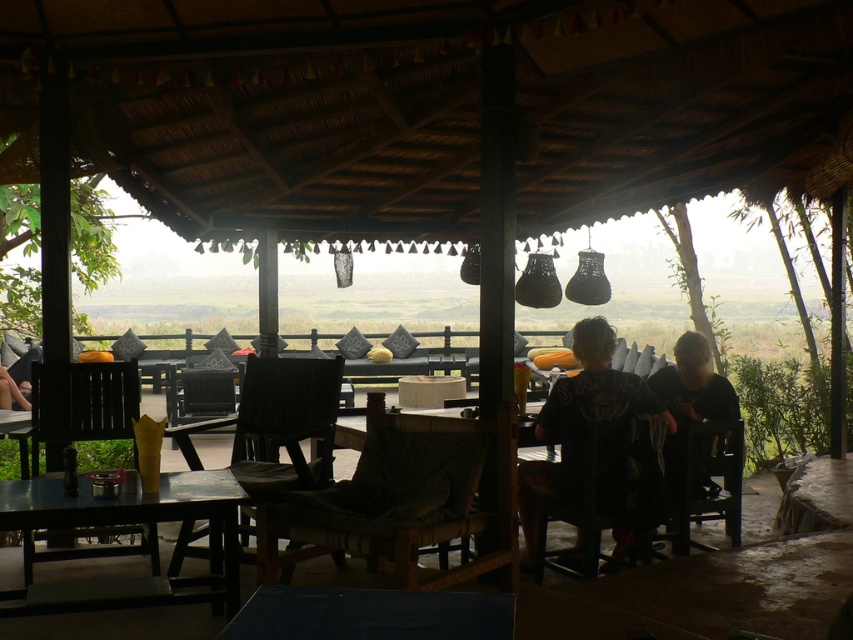
Measure the distance between point (218,476) and camera.

Point (218,476) is 3.64 meters away from camera.

Which is more to the left, wooden table at lower left or dark brown leather jacket at center?

wooden table at lower left is more to the left.

Identify the location of wooden table at lower left. The height and width of the screenshot is (640, 853). (125, 522).

Between point (730, 442) and point (1, 406), which one is positioned in front?

Point (730, 442) is in front.

Could you measure the distance between dark brown wooden chair at lower right and dark brown leather chair at lower left?

They are 7.01 meters apart.

Between point (688, 476) and point (0, 368), which one is positioned behind?

The point (0, 368) is behind.

Locate an element on the screen. dark brown wooden chair at lower right is located at coordinates (704, 480).

This screenshot has height=640, width=853. Identify the location of wooden table at lower left. (125, 522).

Which is behind, point (199, 497) or point (724, 416)?

The point (724, 416) is more distant.

Does point (164, 593) come farther from viewer compared to point (695, 404)?

No, (164, 593) is closer to viewer.

Where is `wooden table at lower left`? wooden table at lower left is located at coordinates (125, 522).